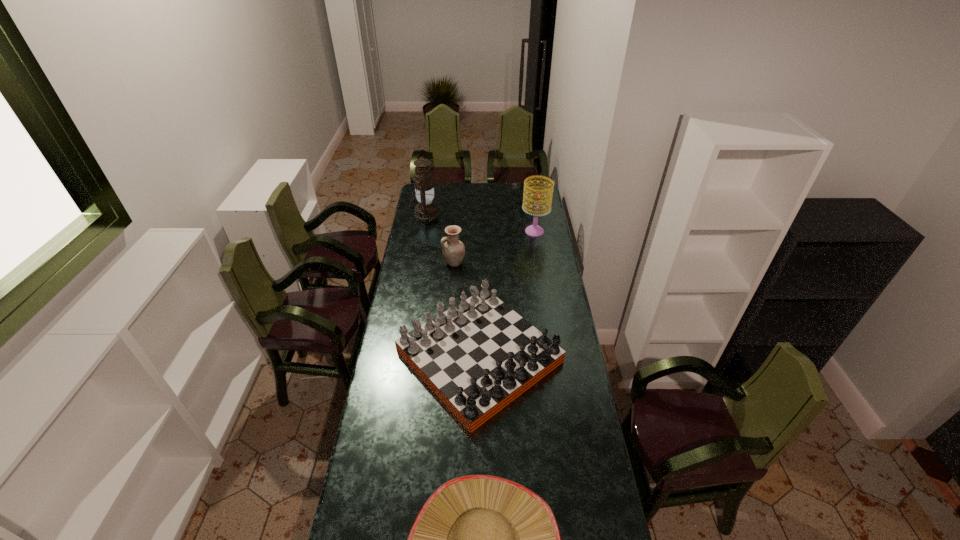
At what (x,y) coordinates should I click in order to perform the action: click on oil lamp. Please return your answer as a coordinate pair (x, y). The height and width of the screenshot is (540, 960). Looking at the image, I should click on (426, 211).

Identify the location of lampshade. (534, 230).

Locate an element on the screen. the third farthest object is located at coordinates (453, 250).

Where is `pottery`? This screenshot has height=540, width=960. pottery is located at coordinates (x=453, y=250).

Locate an element on the screen. gameboard is located at coordinates (478, 356).

The image size is (960, 540). What are the coordinates of `free space located 0.110m on the right of the oil lamp` in the screenshot? It's located at (457, 215).

At what (x,y) coordinates should I click in order to perform the action: click on vacant area situated 0.270m on the left of the lampshade. Please return your answer as a coordinate pair (x, y). This screenshot has height=540, width=960. Looking at the image, I should click on (474, 231).

Identify the location of free point located on the back of the pottery. (457, 218).

Where is `vacant space positioned on the back of the gameboard`? This screenshot has width=960, height=540. vacant space positioned on the back of the gameboard is located at coordinates (479, 267).

Where is `oil lamp positioned at the left edge`? oil lamp positioned at the left edge is located at coordinates (426, 211).